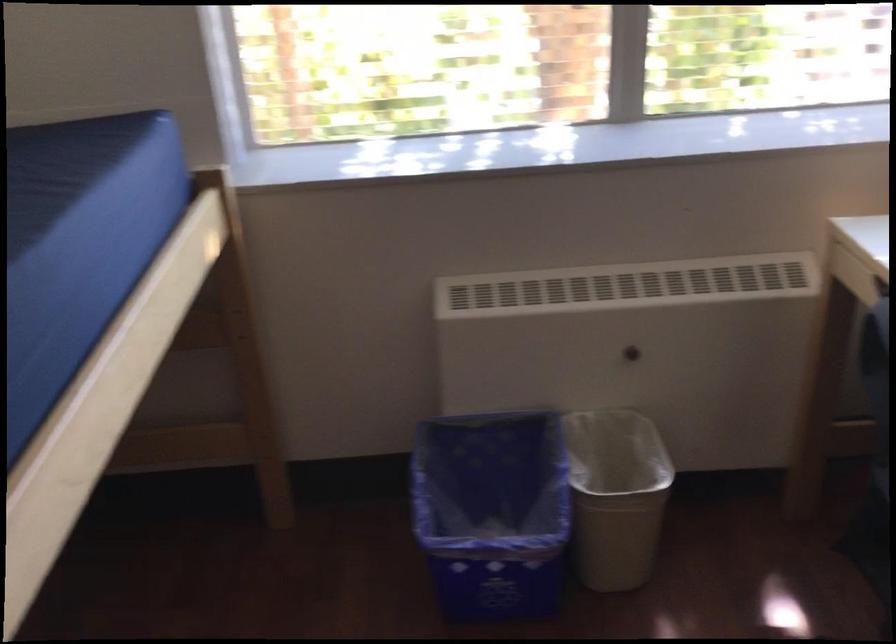
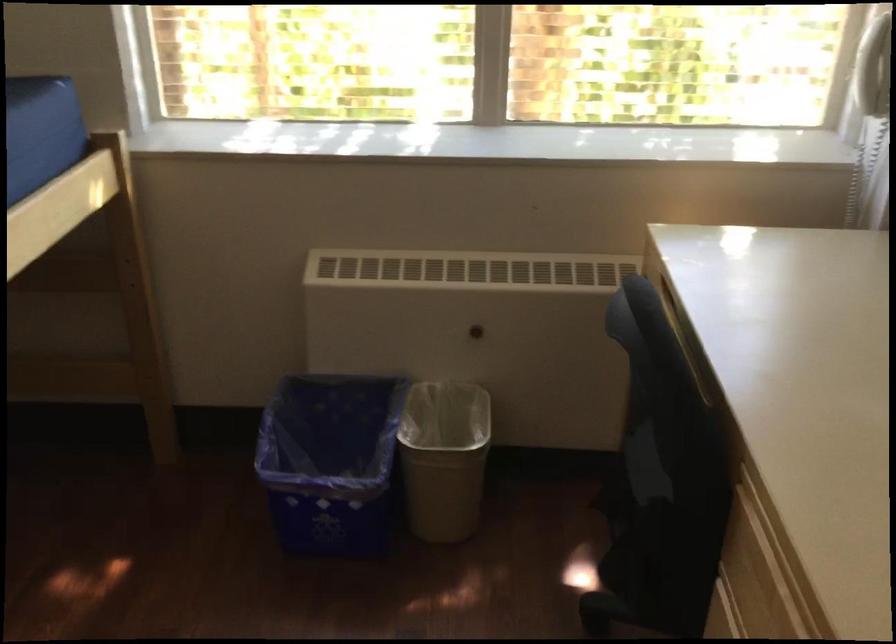
The point at (631, 353) is marked in the first image. Where is the corresponding point in the second image?

(476, 330)